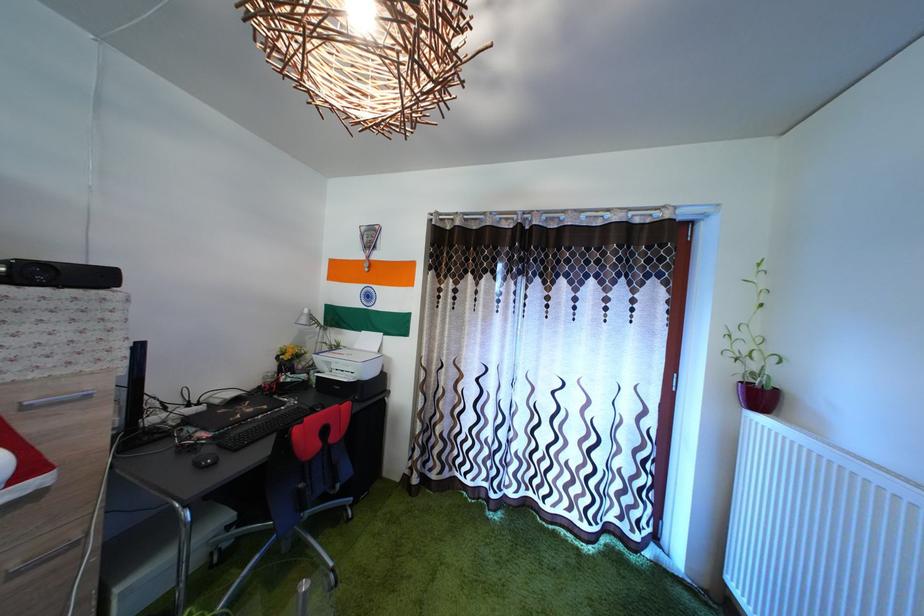
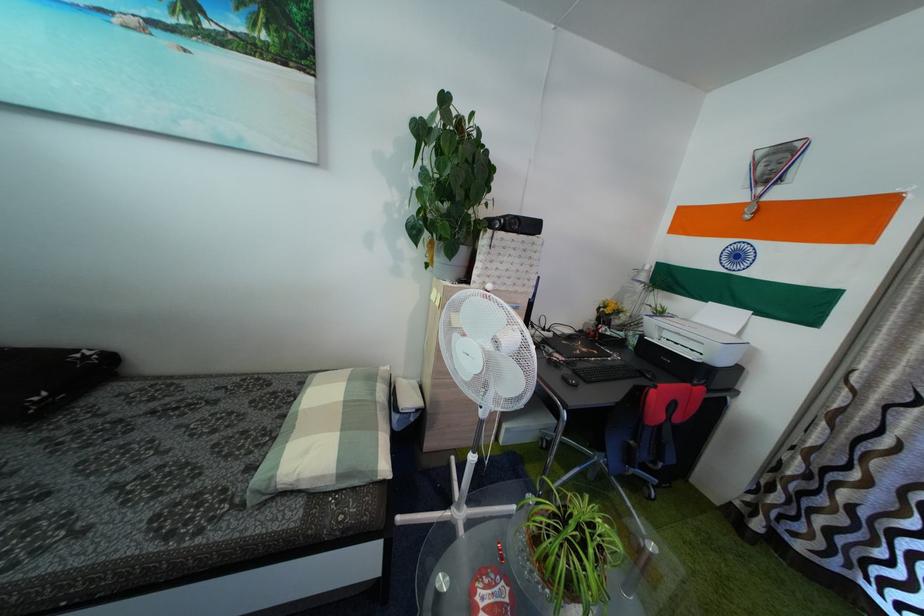
In the second image, find the point that corresponds to (x=217, y=456) in the first image.

(575, 379)